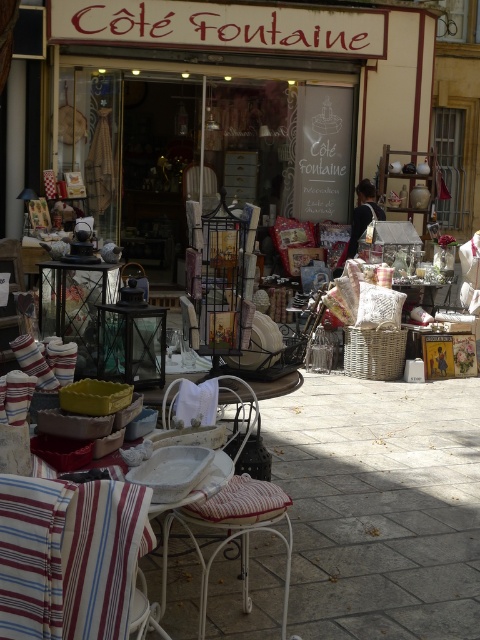
You are a customer entering the shop and need to sit down. There is a white wicker chair at center and a white striped fabric at lower left. Which one is taller and thus more suitable for sitting?

The white wicker chair at center is taller than the white striped fabric at lower left, so it is more suitable for sitting.

You are a customer standing in front of the shop and want to pick up the striped fabric cushion at lower left. Can you reach it without moving the white striped fabric at lower left?

The striped fabric cushion at lower left is in front of the white striped fabric at lower left, so you can reach it without moving the white striped fabric at lower left.

In the scene shown: You are a customer standing in front of the shop entrance. You want to sit down to rest. Which object should you approach first, the striped fabric cushion at lower left or the white wicker chair at center?

You should approach the white wicker chair at center first because the striped fabric cushion at lower left is to the left of it, meaning the chair is closer to the entrance where you are standing.